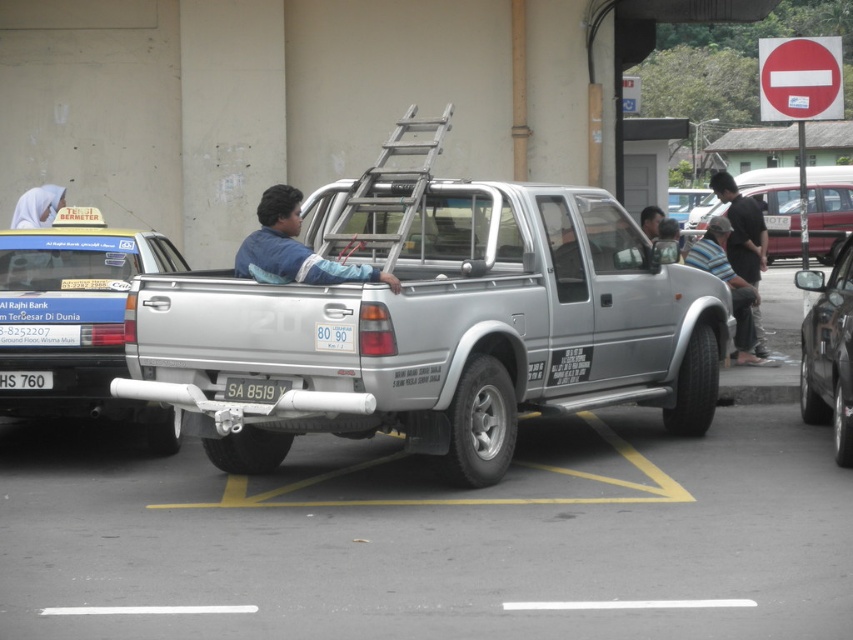
You are standing at the center of the parking lot and want to find the metallic silver car at right. According to the parking lot layout, where should you look relative to your current position?

The metallic silver car at right is located at the 2D coordinates point (828,353), which is to the lower right direction from your current position at the center of the parking lot.

You are a delivery driver who needs to park your vehicle in the parking lot. You see the metallic silver car at right and the white plastic license plate at rear. Which object is closer to the parking lot entrance?

The metallic silver car at right is positioned under the white plastic license plate at rear, so the white plastic license plate at rear is closer to the parking lot entrance.